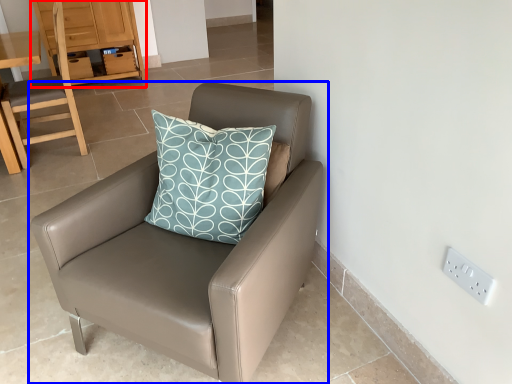
Question: Which point is closer to the camera, dresser (highlighted by a red box) or chair (highlighted by a blue box)?

Choices:
 (A) dresser
 (B) chair

Answer: (B)